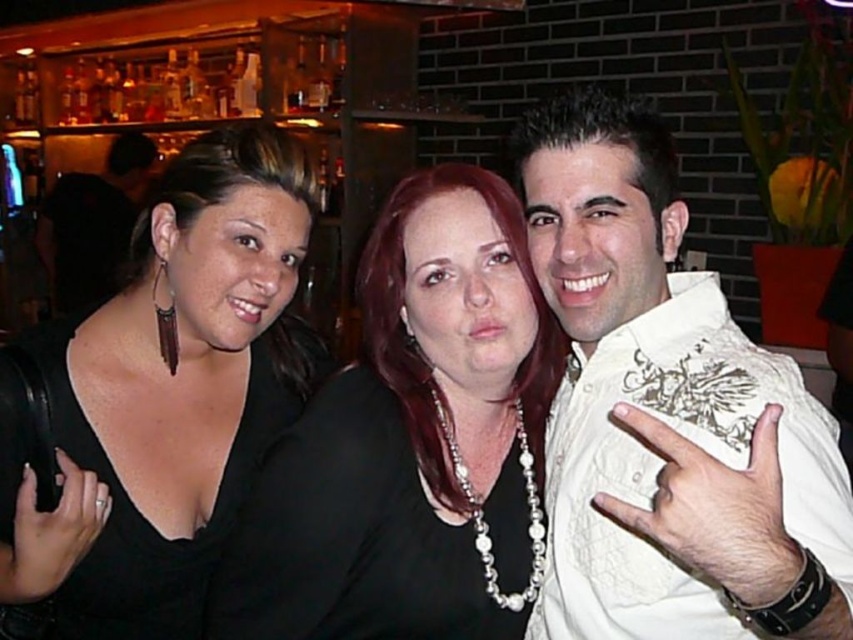
You are a photographer adjusting the lighting for a group photo. You notice the white textured shirt at right and the black fabric dress at left in the frame. Which clothing item should you focus on first to ensure proper exposure, considering their positions?

The white textured shirt at right is in front of the black fabric dress at left, so you should focus on adjusting the lighting for the white textured shirt at right first to ensure it doesn

You are a photographer standing at the back of the room. You want to take a photo of the white textured shirt at right and the black fabric dress at left. How far apart are these two items in the scene?

The white textured shirt at right is 20.49 inches away from the black fabric dress at left.